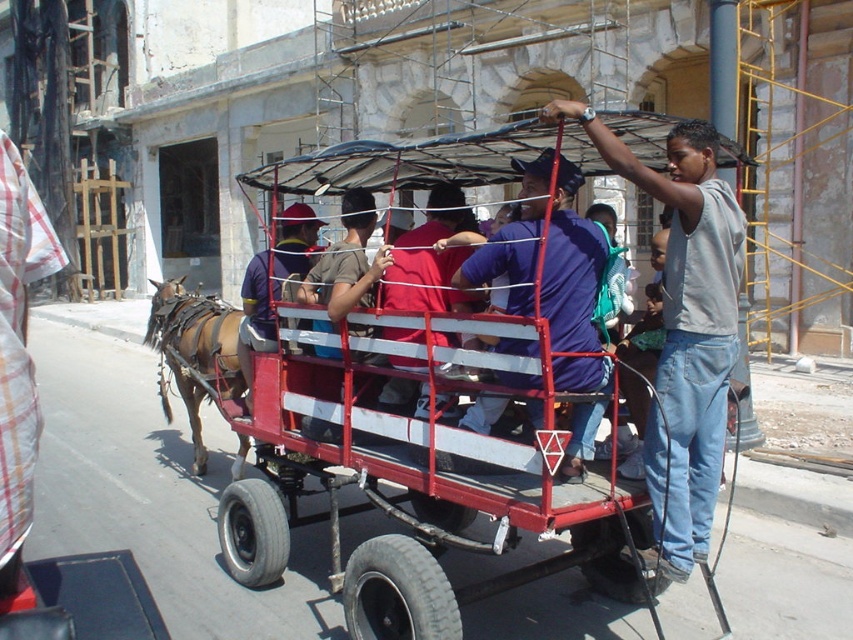
You are a photographer standing on the sidewalk. You want to take a photo of the metallic red cart at center and the blue denim shirt at center. Based on their positions, which object should you focus on first to ensure both are in the frame?

The metallic red cart at center is below blue denim shirt at center, so you should focus on the blue denim shirt at center first to ensure both are in the frame.

You are standing at the origin point of the coordinate system in the street scene. The metallic red cart at center is at position 0.673 on the x axis and 0.505 on the y axis. If you want to walk directly to the cart, which direction should you head?

To reach the metallic red cart at center located at coordinates x 0.673 and y 0.505, you should move towards the right along the x axis and slightly forward along the y axis from your current position at the origin.